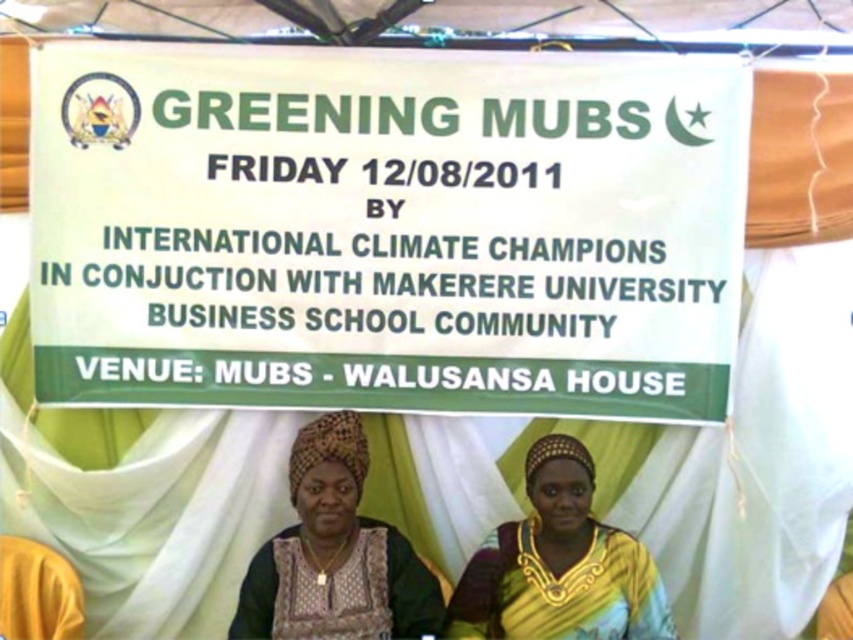
Does point (323, 416) come farther from viewer compared to point (552, 444)?

Yes, it is behind point (552, 444).

Does black woven fabric headscarf at center have a greater width compared to yellow fabric headscarf at center?

No.

Is point (376, 548) less distant than point (534, 630)?

No, it is behind (534, 630).

Find the location of a particular element. This screenshot has height=640, width=853. black woven fabric headscarf at center is located at coordinates (335, 554).

Between white paper sign at center and black woven fabric headscarf at center, which one appears on the left side from the viewer's perspective?

Positioned to the left is black woven fabric headscarf at center.

Does white paper sign at center come in front of black woven fabric headscarf at center?

No, white paper sign at center is further to the viewer.

Which is in front, point (314, 81) or point (341, 413)?

Point (341, 413) is in front.

This screenshot has height=640, width=853. I want to click on white paper sign at center, so click(x=386, y=228).

Can you confirm if white paper sign at center is positioned below yellow fabric headscarf at center?

Incorrect, white paper sign at center is not positioned below yellow fabric headscarf at center.

Is white paper sign at center positioned at the back of yellow fabric headscarf at center?

Yes, it is behind yellow fabric headscarf at center.

What do you see at coordinates (386, 228) in the screenshot? The width and height of the screenshot is (853, 640). I see `white paper sign at center` at bounding box center [386, 228].

Find the location of a particular element. This screenshot has height=640, width=853. white paper sign at center is located at coordinates (386, 228).